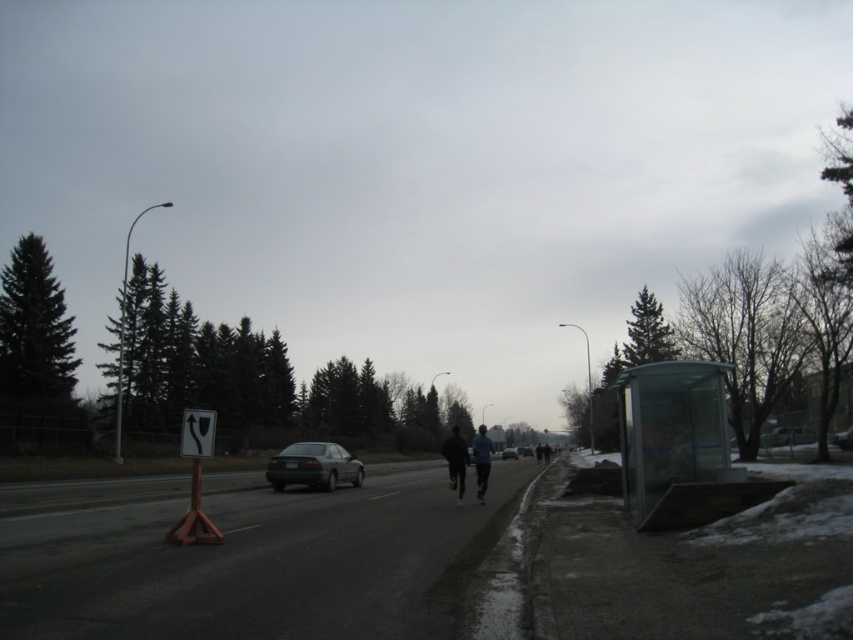
You are standing at the point of observation in the scene. You need to locate the dark matte jacket at center. Please provide its coordinates in the image.

The dark matte jacket at center is located at coordinates point (456, 460).

You are a pedestrian trying to find shelter from the rain. The transparent glass bus stop at right and the dark blue fabric jacket at center are both nearby. Which one is smaller in size and thus might be harder to use for shelter?

The transparent glass bus stop at right is smaller in size than the dark blue fabric jacket at center, so it might be harder to use for shelter because it occupies less space.